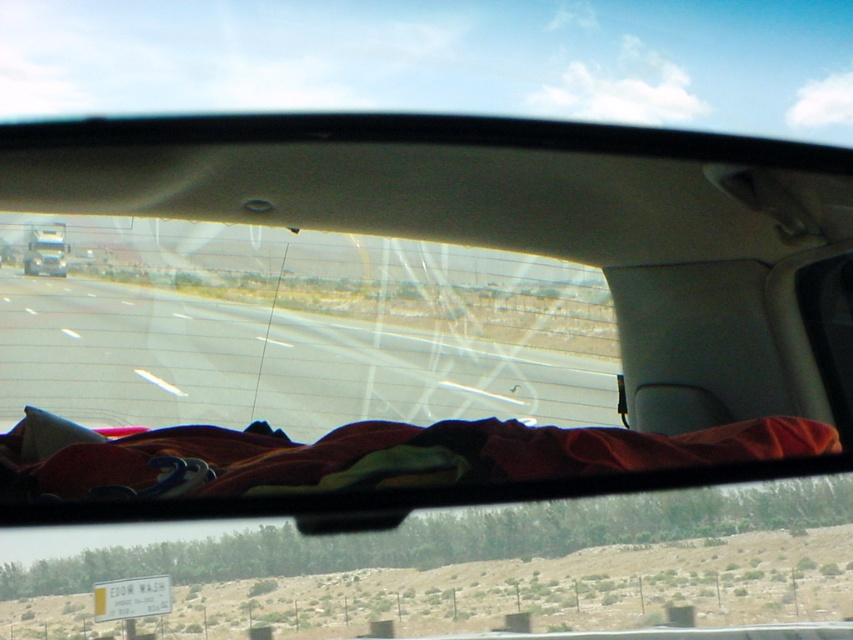
Question: Which of the following is the closest to the observer?

Choices:
 (A) (90, 483)
 (B) (28, 269)
 (C) (178, 221)

Answer: (A)

Question: Does transparent glass car window at center appear over metallic silver truck at left?

Choices:
 (A) yes
 (B) no

Answer: (B)

Question: Which point is farther to the camera?

Choices:
 (A) transparent glass car window at center
 (B) velvet-like red blanket at lower center

Answer: (A)

Question: Is velvet-like red blanket at lower center below metallic silver truck at left?

Choices:
 (A) no
 (B) yes

Answer: (B)

Question: Which point appears closest to the camera in this image?

Choices:
 (A) (24, 253)
 (B) (598, 452)

Answer: (B)

Question: Is velvet-like red blanket at lower center further to the viewer compared to metallic silver truck at left?

Choices:
 (A) yes
 (B) no

Answer: (B)